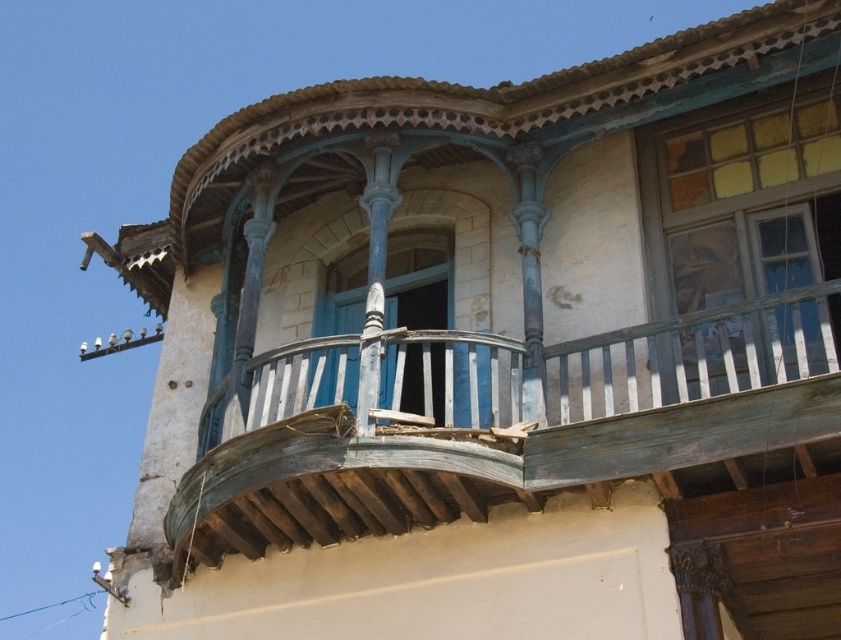
You are standing at the base of the old building and looking up at the balcony. There are two points marked on the balcony structure. The first point is at coordinates point (566,376) and the second is at point (347,401). From your perspective, which point appears closer to you?

Point (566,376) is in front of point (347,401), so it appears closer to you.